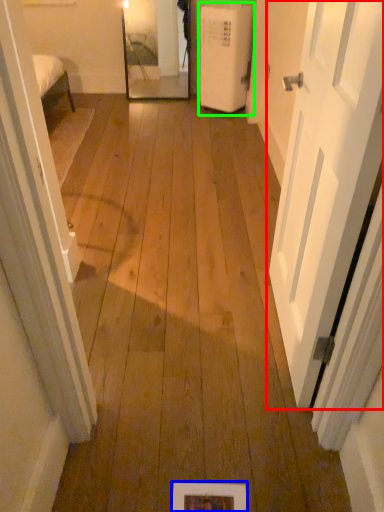
Question: Which object is positioned closest to door (highlighted by a red box)? Select from picture frame (highlighted by a blue box) and air conditioner (highlighted by a green box).

Choices:
 (A) picture frame
 (B) air conditioner

Answer: (A)